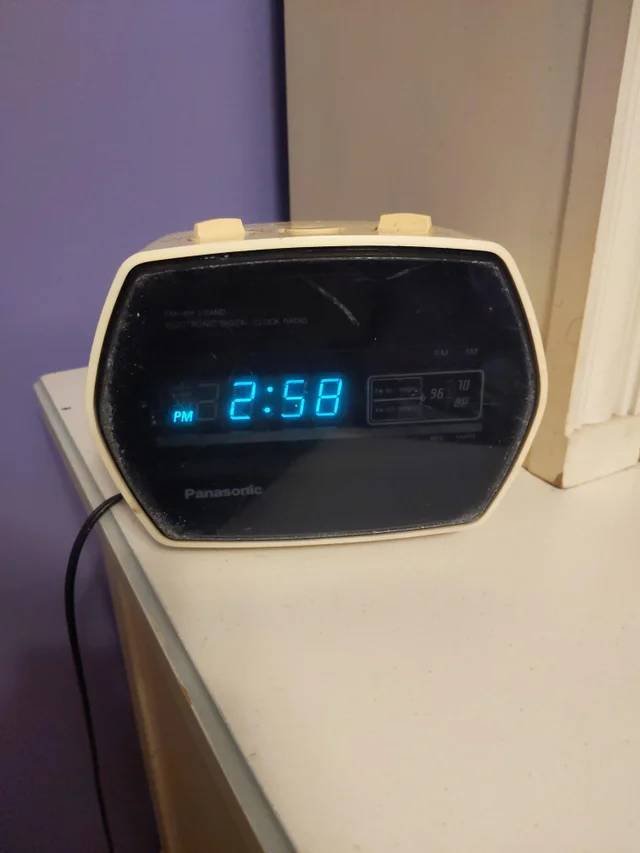
I want to click on alarm clock, so click(x=331, y=286).